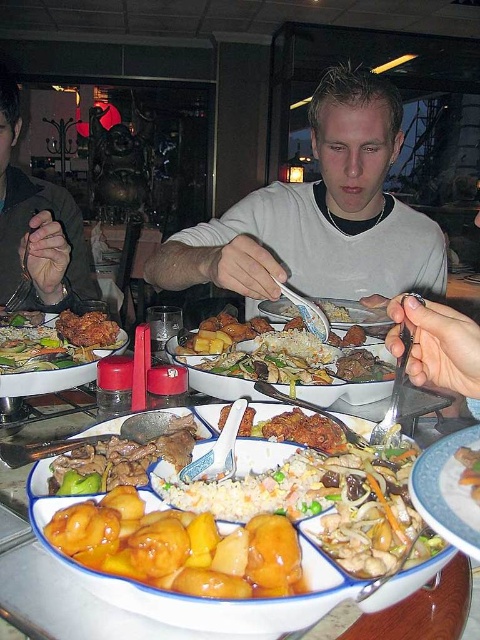
You are a diner at the communal table and need to choose between the wooden chopsticks at center and the shiny silver spoon at center. Which one is smaller in size?

The wooden chopsticks at center is smaller than the shiny silver spoon at center.

You are a diner at the communal table and want to use the wooden chopsticks at center to pick up food from the shiny silver spoon at center. Can you reach the spoon with the chopsticks?

The wooden chopsticks at center is in front of the shiny silver spoon at center, so they are already positioned closer to you than the spoon. To reach the spoon, you would need to move the chopsticks backward towards it.